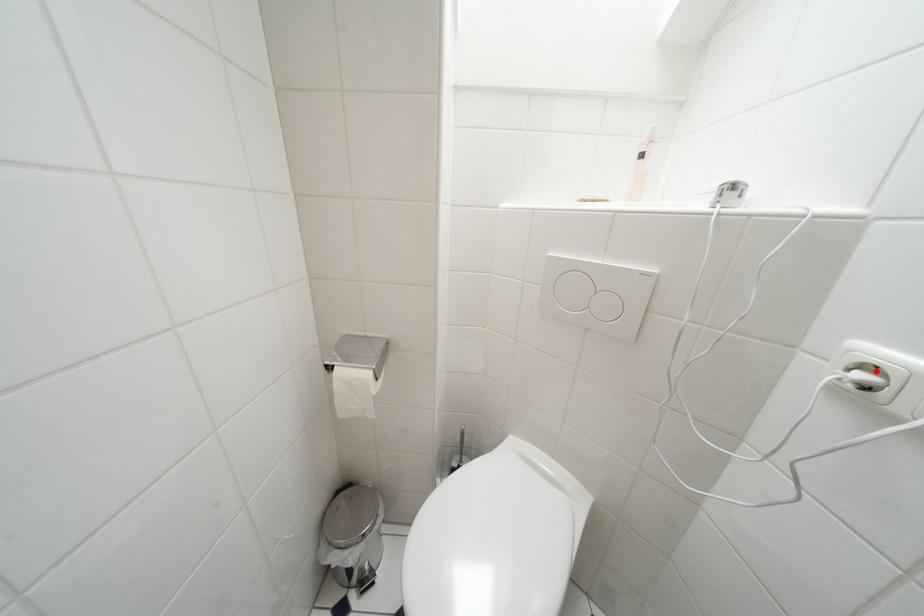
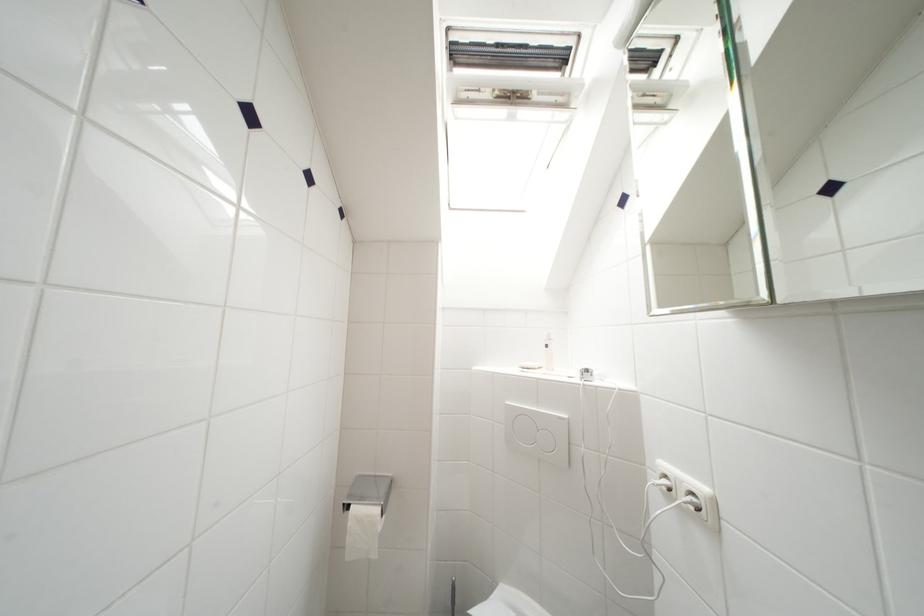
In the second image, find the point that corresponds to the highlighted location in the first image.

(672, 480)